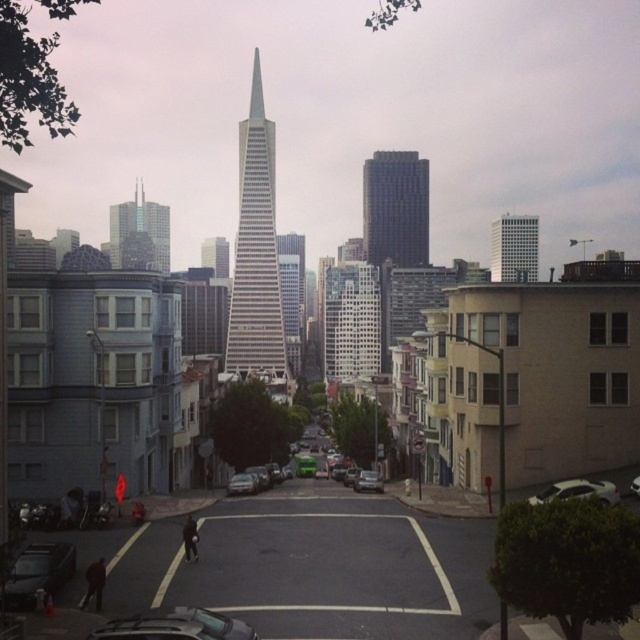
Question: Is white glass building at center to the right of glassy white skyscraper at center from the viewer's perspective?

Choices:
 (A) yes
 (B) no

Answer: (A)

Question: Which of these objects is positioned closest to the metallic silver sedan at center?

Choices:
 (A) shiny black sedan at lower left
 (B) glassy reflective skyscraper at upper center
 (C) glassy white skyscraper at center

Answer: (A)

Question: Which object appears closest to the camera in this image?

Choices:
 (A) shiny black sedan at lower left
 (B) silver metallic car at center

Answer: (A)

Question: Which point is farther from the camera taking this photo?

Choices:
 (A) (22, 588)
 (B) (536, 497)
 (C) (369, 172)
 (D) (109, 637)

Answer: (C)

Question: Does silver glass skyscraper at center come behind glassy white skyscraper at center?

Choices:
 (A) yes
 (B) no

Answer: (B)

Question: Does glassy reflective skyscraper at upper center appear under white matte car at center?

Choices:
 (A) no
 (B) yes

Answer: (A)